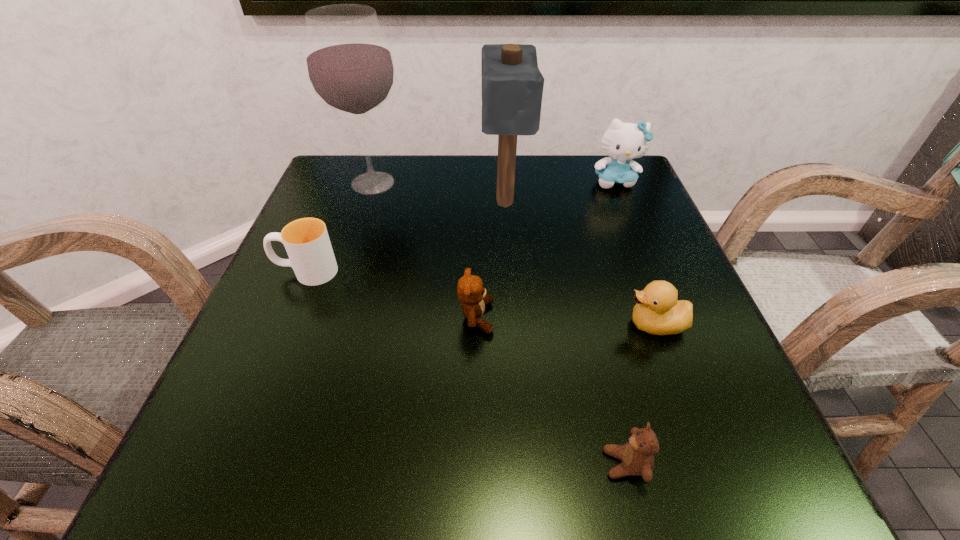
Identify the location of vacant region between the mallet and the right teddy bear. The height and width of the screenshot is (540, 960). (565, 333).

Where is `free space between the duckling and the nearer teddy bear`? The width and height of the screenshot is (960, 540). free space between the duckling and the nearer teddy bear is located at coordinates (640, 394).

At what (x,y) coordinates should I click in order to perform the action: click on free area in between the alcohol and the cup. Please return your answer as a coordinate pair (x, y). Looking at the image, I should click on (340, 227).

Find the location of `free spot between the fourth nearest object and the nearest object`. free spot between the fourth nearest object and the nearest object is located at coordinates tap(466, 368).

Where is `object that is the fourth closest one to the duckling`? This screenshot has width=960, height=540. object that is the fourth closest one to the duckling is located at coordinates (623, 142).

This screenshot has width=960, height=540. In order to click on object that is the second closest to the farther teddy bear in this screenshot , I will do `click(657, 311)`.

Identify the location of free point that satisfies the following two spatial constraints: 1. with the handle on the side of the cup; 2. on the right side of the mallet. (335, 201).

This screenshot has width=960, height=540. Find the location of `vacant region that satisfies the following two spatial constraints: 1. on the face of the fifth shortest object; 2. on the front-facing side of the left teddy bear`. vacant region that satisfies the following two spatial constraints: 1. on the face of the fifth shortest object; 2. on the front-facing side of the left teddy bear is located at coordinates (670, 318).

In order to click on free location that satisfies the following two spatial constraints: 1. with the handle on the side of the mallet; 2. on the right side of the fourth farthest object in this screenshot , I will do `click(335, 201)`.

Find the location of `vacant space that satisfies the following two spatial constraints: 1. with the handle on the side of the mallet; 2. on the right side of the fourth farthest object`. vacant space that satisfies the following two spatial constraints: 1. with the handle on the side of the mallet; 2. on the right side of the fourth farthest object is located at coordinates (335, 201).